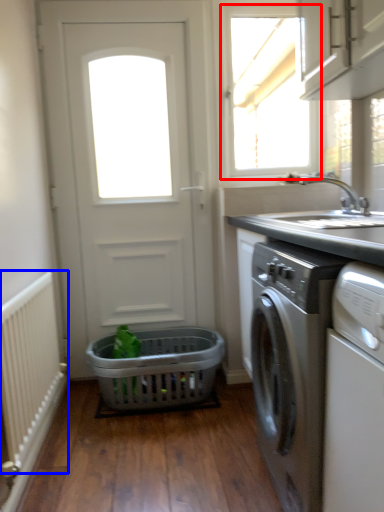
Question: Which object appears farthest to the camera in this image, window (highlighted by a red box) or radiator (highlighted by a blue box)?

Choices:
 (A) window
 (B) radiator

Answer: (A)